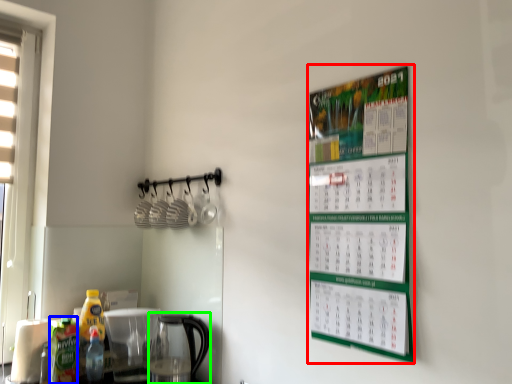
Question: Estimate the real-world distances between objects in this image. Which object is closer to bulletin board (highlighted by a red box), bottle (highlighted by a blue box) or coffeepot (highlighted by a green box)?

Choices:
 (A) bottle
 (B) coffeepot

Answer: (B)